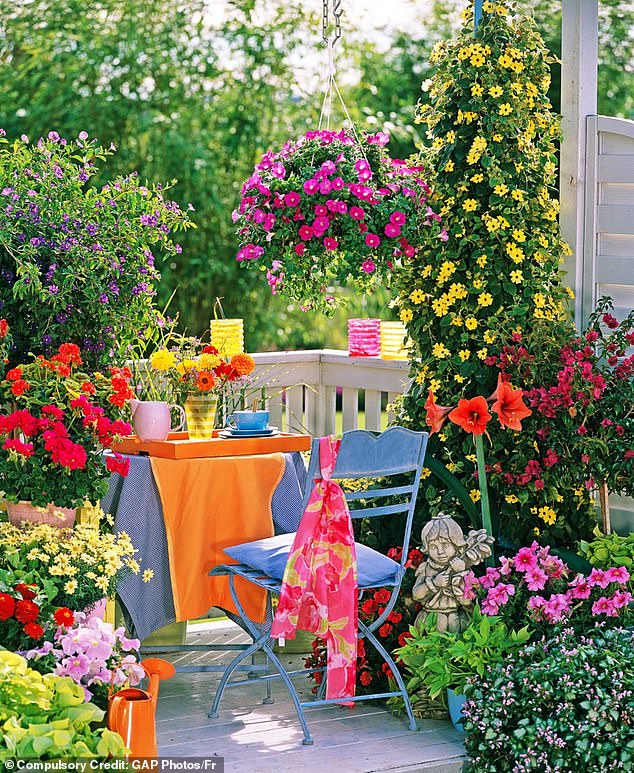
Locate an element on the screen. Image resolution: width=634 pixels, height=773 pixels. tray is located at coordinates (205, 445).